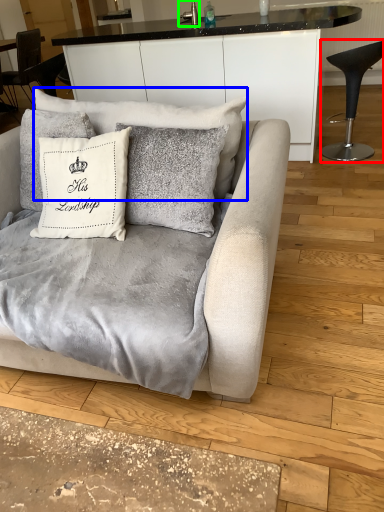
Question: Considering the real-world distances, which object is closest to chair (highlighted by a red box)? pillow (highlighted by a blue box) or silver (highlighted by a green box).

Choices:
 (A) pillow
 (B) silver

Answer: (B)